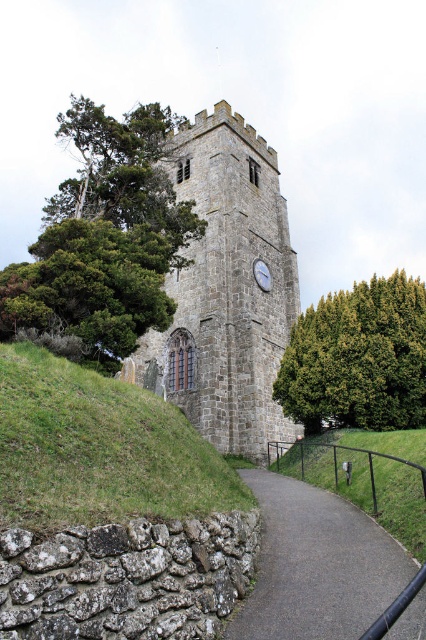
You are standing at the entrance of the historic stone tower and want to reach the paved pathway that curves around the base. According to the image, where exactly is the black asphalt path at lower center located?

The black asphalt path at lower center is located at point (316, 564), so you can find it there.

You are a landscape architect designing a new garden layout. You need to place a statue exactly halfway between the gray stone clock tower at center and the green leafy tree at upper left. Which object will the statue be closer to?

The statue will be closer to the gray stone clock tower at center because it is smaller in size compared to the green leafy tree at upper left, so the halfway point would be nearer to the smaller object.